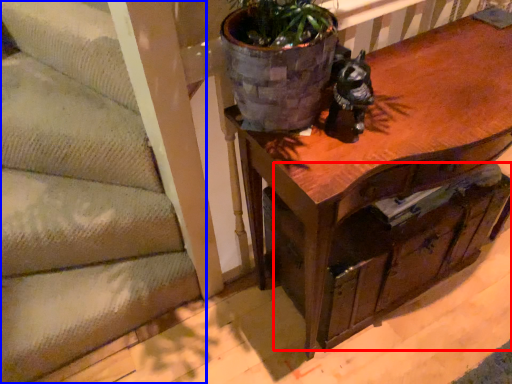
Question: Which point is closer to the camera, drawer (highlighted by a red box) or stairwell (highlighted by a blue box)?

Choices:
 (A) drawer
 (B) stairwell

Answer: (A)